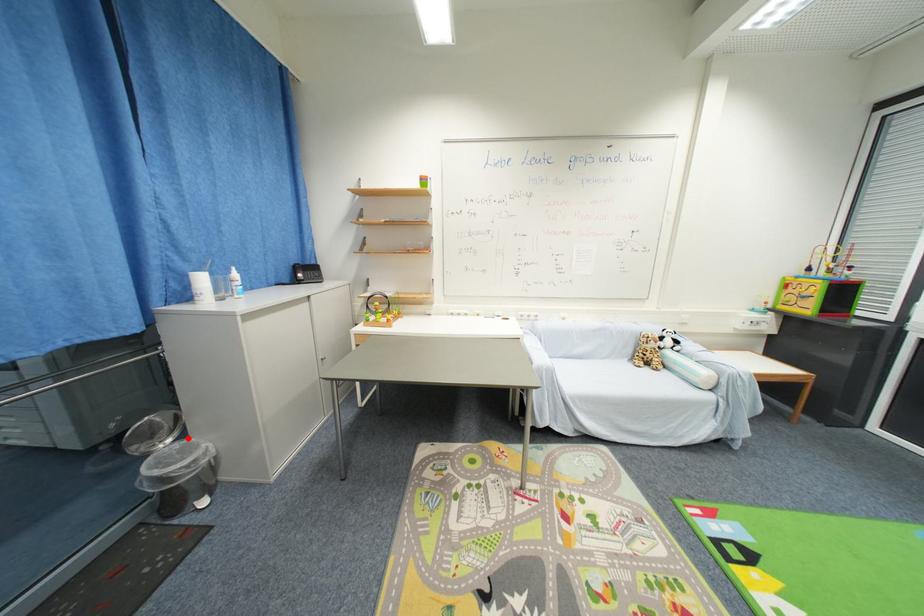
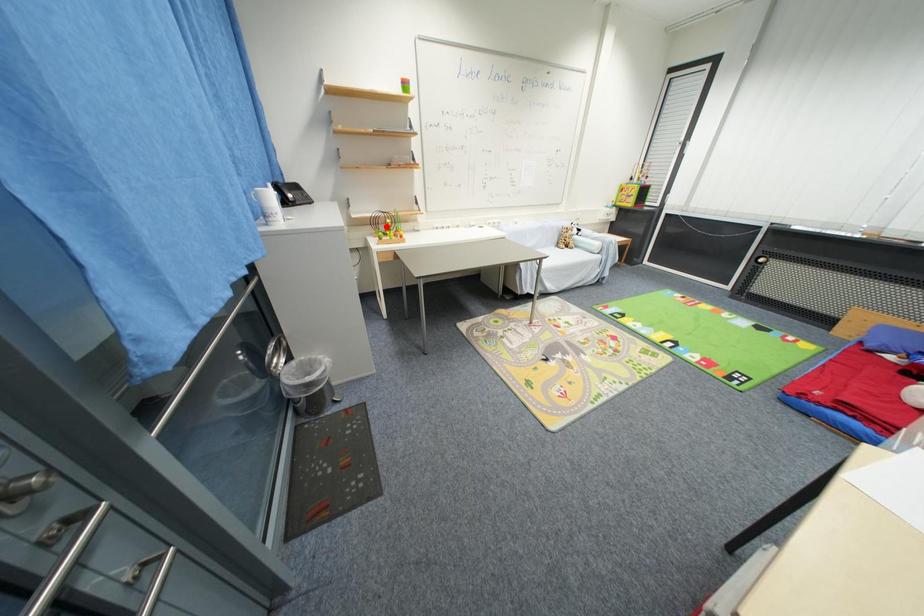
I am providing you with two images of the same scene from different viewpoints. A red point is marked on the first image and another point is marked on the second image. Is the red point in image1 aligned with the point shown in image2?

No